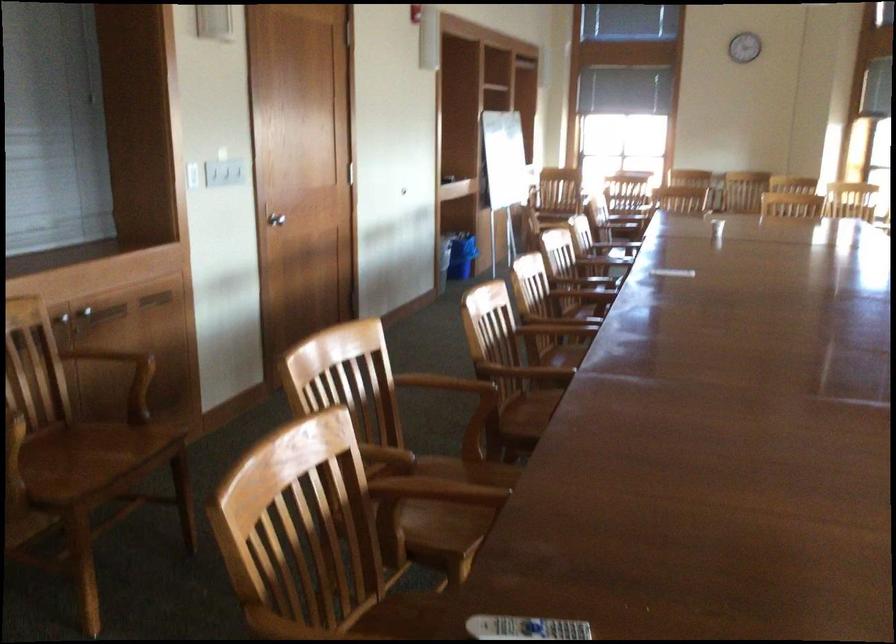
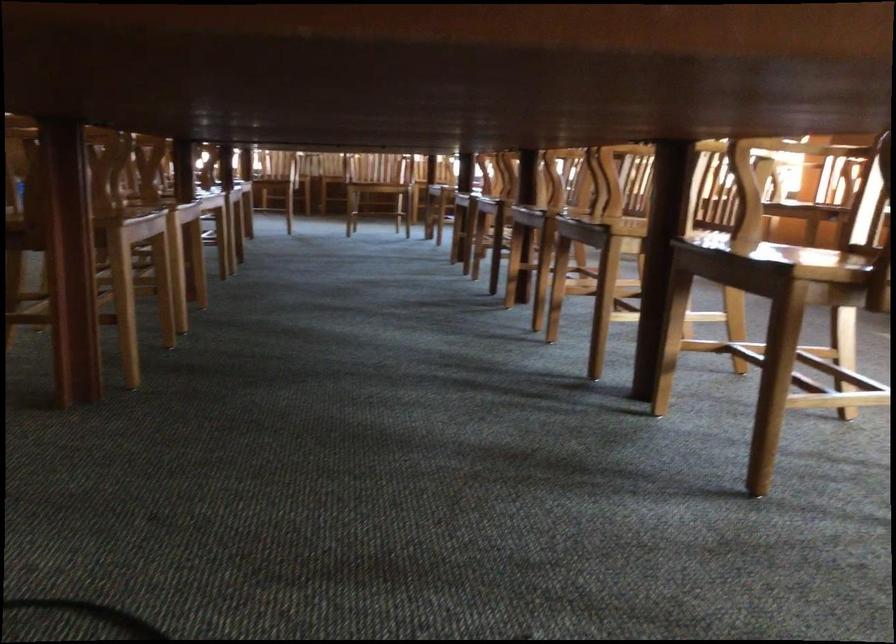
Question: The images are taken continuously from a first-person perspective. In which direction is your viewpoint rotating?

Choices:
 (A) Left
 (B) Right
 (C) Up
 (D) Down

Answer: (B)